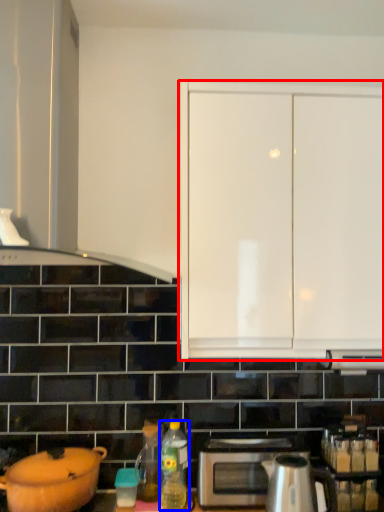
Question: Which point is further to the camera, cabinetry (highlighted by a red box) or bottle (highlighted by a blue box)?

Choices:
 (A) cabinetry
 (B) bottle

Answer: (B)